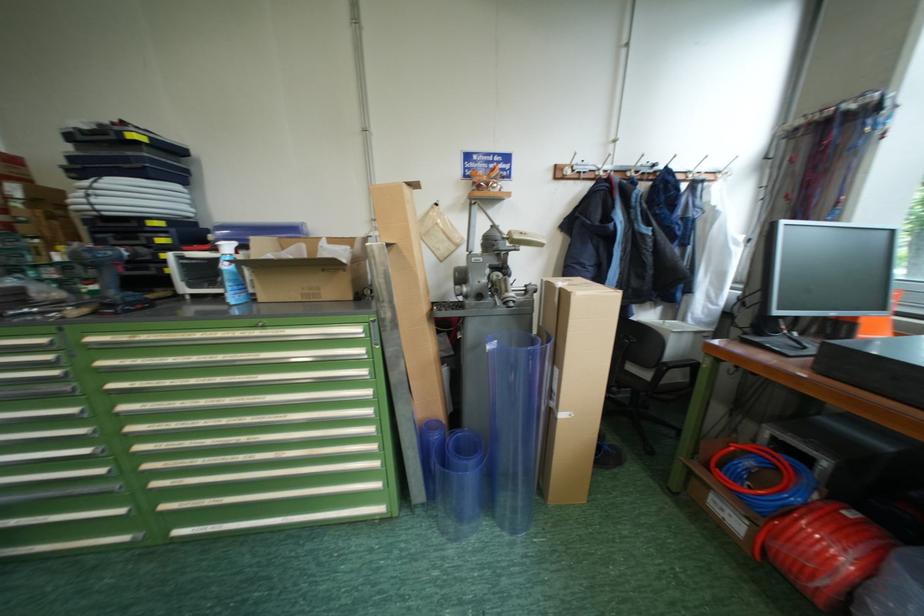
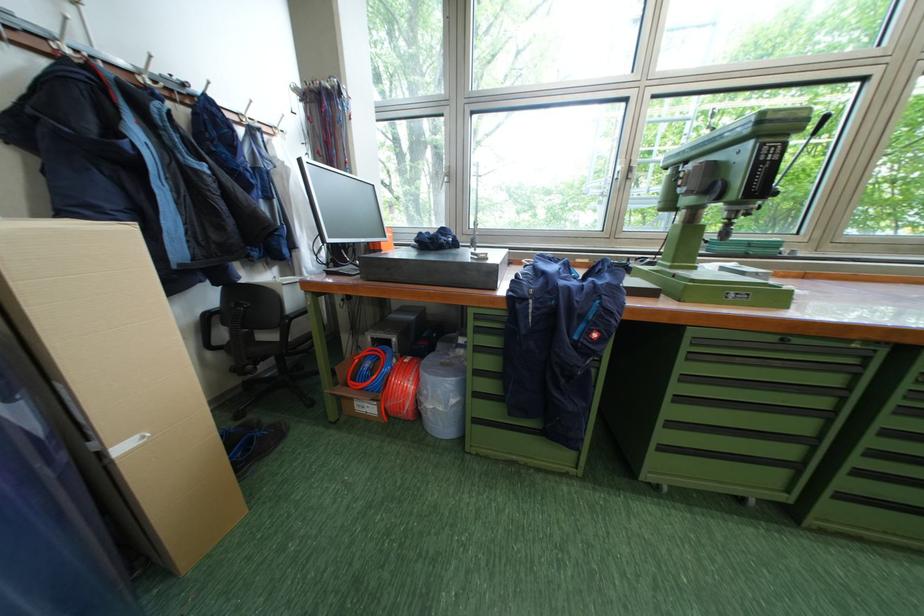
Where in the second image is the point corresponding to (722,475) from the first image?

(359, 389)